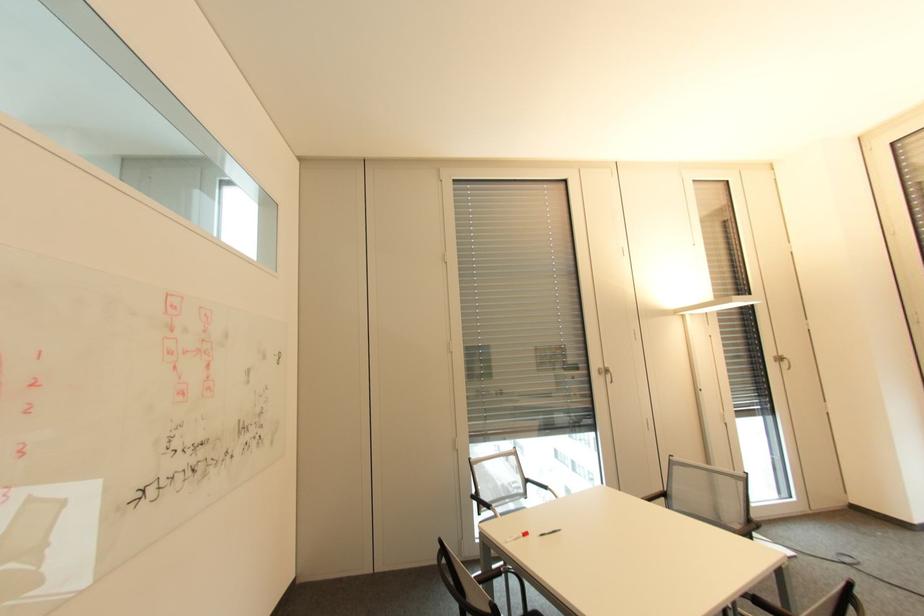
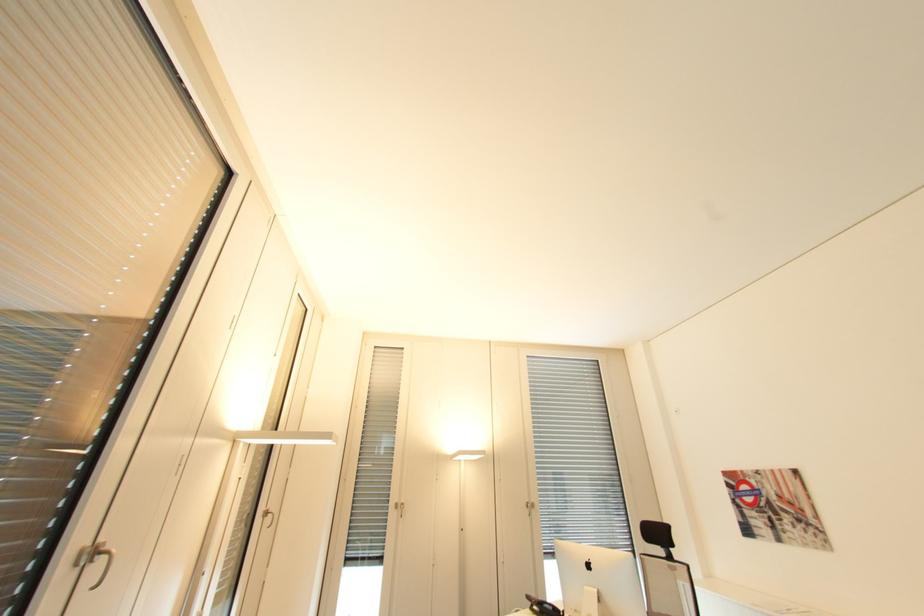
Locate, in the second image, the point that corresponds to (612,371) in the first image.

(99, 554)